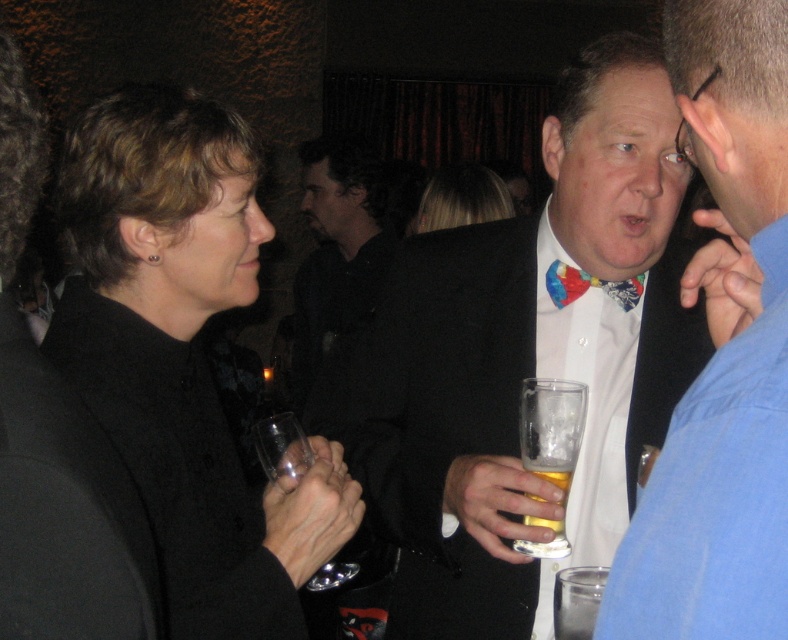
In the image, there are two objects labeled as the white shirt with bow tie at center and the point (x=723, y=358). Which object is located at the specified coordinates?

The white shirt with bow tie at center is located at the coordinates point (x=723, y=358).

You are at a party and want to find the shortest person between the white shirt with bow tie at center and the matte black coat at left. Which one should you look for?

The white shirt with bow tie at center has a lesser height compared to matte black coat at left, so you should look for the white shirt with bow tie at center.

You are at a party and want to grab a drink from the bartender. You see the matte black coat at left and the blonde hair at center. Which person is closer to you?

The matte black coat at left is closer to you since its width is less than the blonde hair at center, indicating it is nearer in the scene.